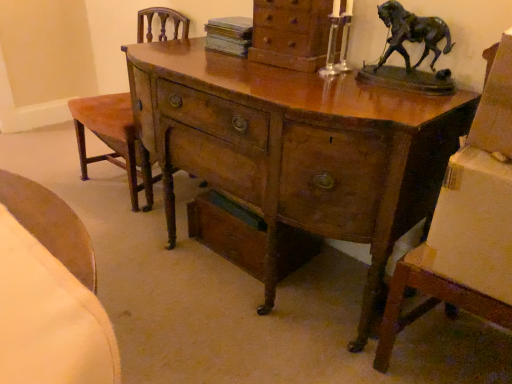
Question: Is wooden drawer at lower center outside of wooden chest of drawers at upper center?

Choices:
 (A) no
 (B) yes

Answer: (B)

Question: Is wooden drawer at lower center positioned with its back to wooden chest of drawers at upper center?

Choices:
 (A) yes
 (B) no

Answer: (B)

Question: Can you see wooden drawer at lower center touching wooden chest of drawers at upper center?

Choices:
 (A) no
 (B) yes

Answer: (A)

Question: Is wooden drawer at lower center not near wooden chest of drawers at upper center?

Choices:
 (A) yes
 (B) no

Answer: (B)

Question: Can you confirm if wooden drawer at lower center is positioned to the left of wooden chest of drawers at upper center?

Choices:
 (A) no
 (B) yes

Answer: (B)

Question: Can you confirm if wooden drawer at lower center is taller than wooden chest of drawers at upper center?

Choices:
 (A) yes
 (B) no

Answer: (A)

Question: From the image's perspective, is wooden chest of drawers at upper center on top of wooden drawer at lower center?

Choices:
 (A) no
 (B) yes

Answer: (B)

Question: Is wooden chest of drawers at upper center wider than wooden drawer at lower center?

Choices:
 (A) yes
 (B) no

Answer: (B)

Question: From a real-world perspective, is wooden chest of drawers at upper center physically above wooden drawer at lower center?

Choices:
 (A) no
 (B) yes

Answer: (B)

Question: Can you confirm if wooden chest of drawers at upper center is thinner than wooden drawer at lower center?

Choices:
 (A) yes
 (B) no

Answer: (A)

Question: Does wooden chest of drawers at upper center have a lesser height compared to wooden drawer at lower center?

Choices:
 (A) no
 (B) yes

Answer: (B)

Question: Is wooden chest of drawers at upper center bigger than wooden drawer at lower center?

Choices:
 (A) yes
 (B) no

Answer: (B)

Question: Does wooden desk at center have a greater height compared to velvet orange armchair at left?

Choices:
 (A) yes
 (B) no

Answer: (B)